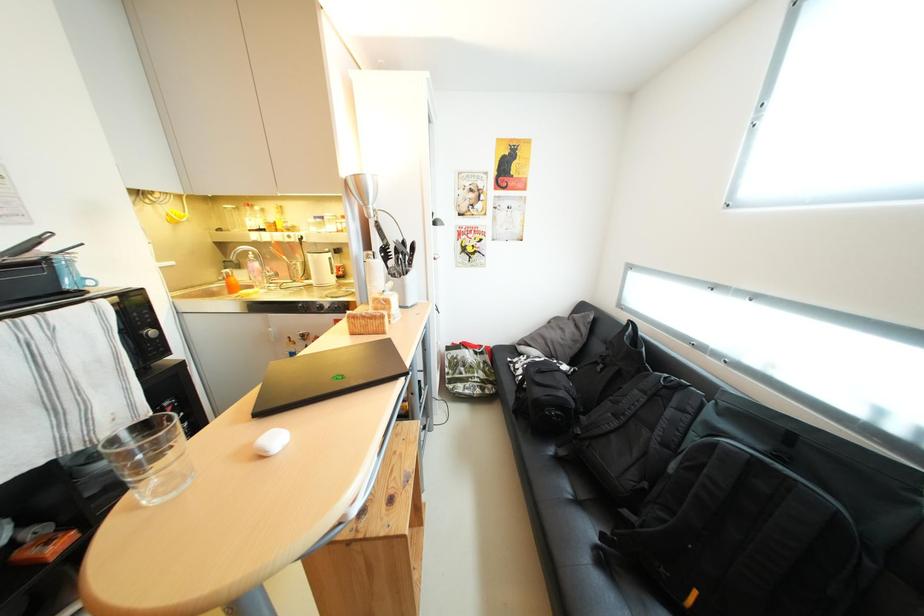
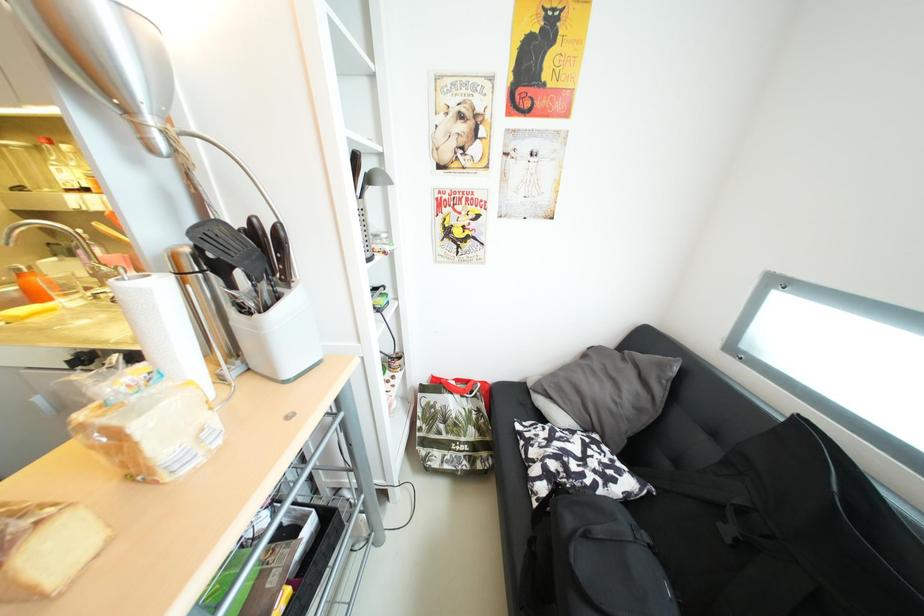
Question: How did the camera likely rotate?

Choices:
 (A) Left
 (B) Right
 (C) Up
 (D) Down

Answer: (D)